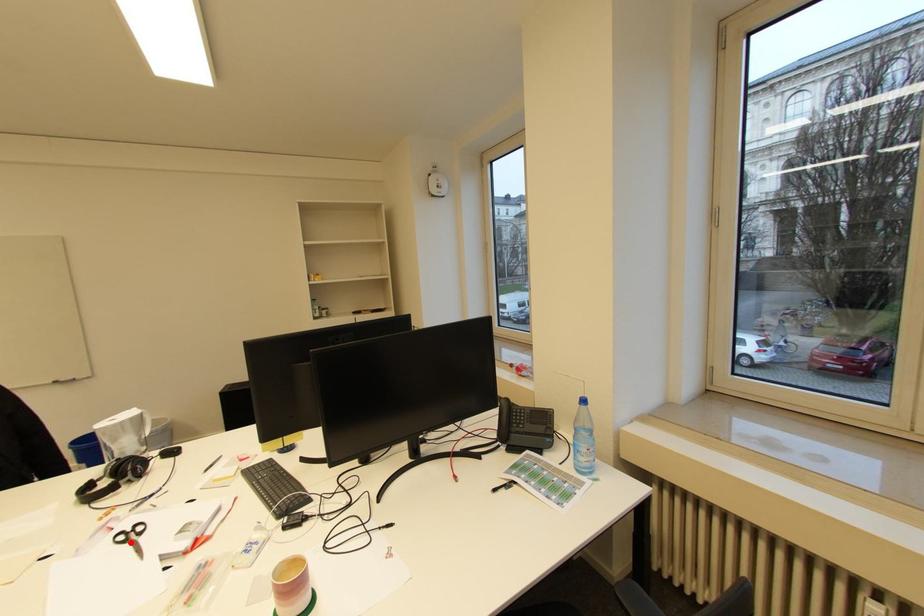
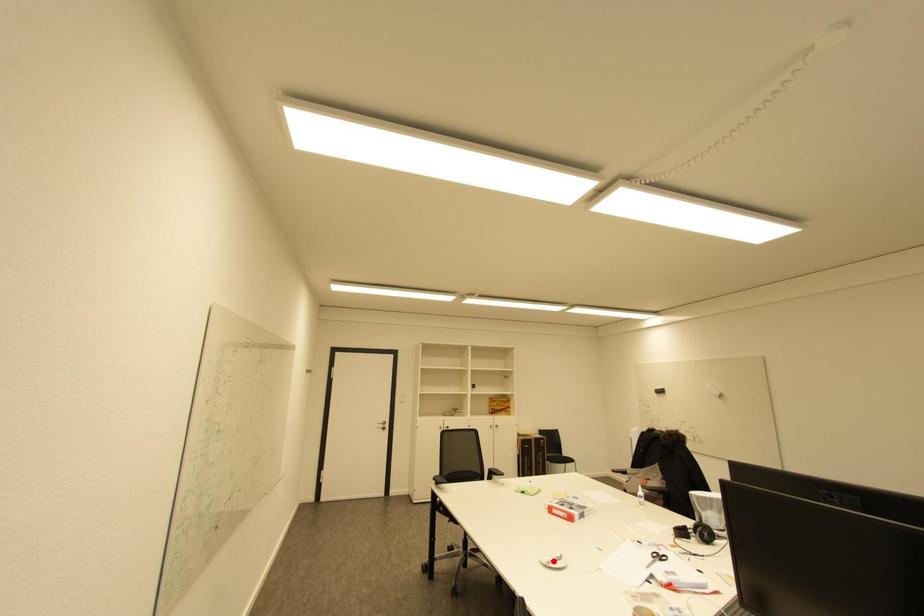
I am providing you with two images of the same scene from different viewpoints. A red point is marked on the first image and another point is marked on the second image. Is the red point in image1 aligned with the point shown in image2?

No